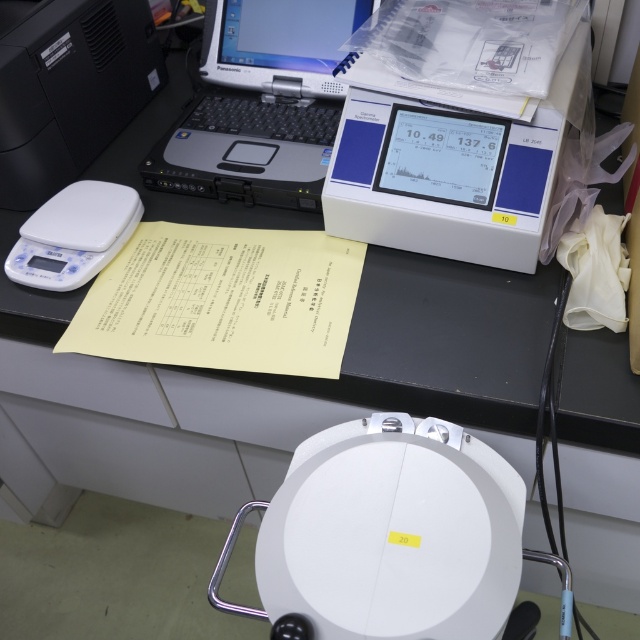
You are a researcher who needs to place a 6.5 inch wide report between the yellow paper at center and the white matte scale at left on the desk. Can you fit it without overlapping either object?

The distance between the yellow paper at center and the white matte scale at left is 7.07 inches. Since the report is 6.5 inches wide, which is less than the available space, you can fit it without overlapping either object.